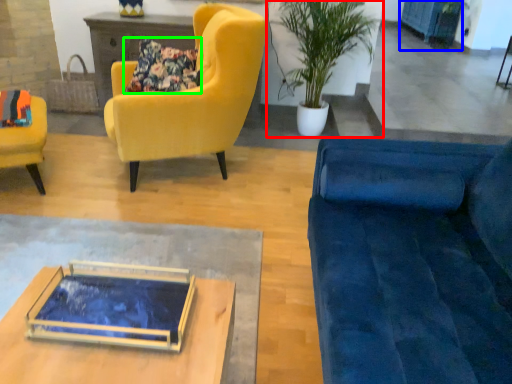
Question: Based on their relative distances, which object is nearer to houseplant (highlighted by a red box)? Choose from cabinetry (highlighted by a blue box) and pillow (highlighted by a green box).

Choices:
 (A) cabinetry
 (B) pillow

Answer: (B)